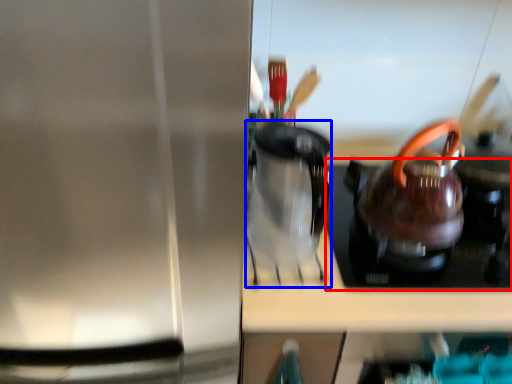
Question: Which object is closer to the camera taking this photo, gas stove (highlighted by a red box) or coffeepot (highlighted by a blue box)?

Choices:
 (A) gas stove
 (B) coffeepot

Answer: (B)